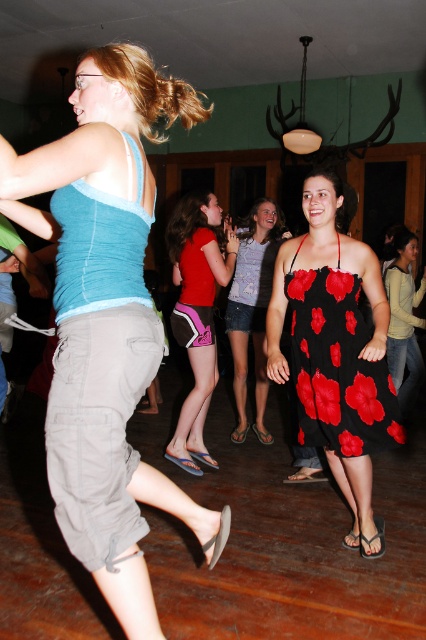
Does point (330, 317) lie behind point (196, 468)?

No, it is in front of (196, 468).

Can you confirm if black floral dress at center is positioned to the right of matte red shorts at center?

Correct, you'll find black floral dress at center to the right of matte red shorts at center.

What do you see at coordinates (336, 365) in the screenshot? I see `black floral dress at center` at bounding box center [336, 365].

Image resolution: width=426 pixels, height=640 pixels. I want to click on black floral dress at center, so click(x=336, y=365).

Which is above, matte blue tank top at center or floral print dress at center?

floral print dress at center is higher up.

Which is in front, point (92, 209) or point (262, 342)?

Point (92, 209)

Is point (201, 529) farther from camera compared to point (273, 232)?

No, it is in front of (273, 232).

Locate an element on the screen. This screenshot has width=426, height=640. matte blue tank top at center is located at coordinates (106, 321).

Based on the photo, does matte red shorts at center have a lesser width compared to floral print dress at center?

Correct, matte red shorts at center's width is less than floral print dress at center's.

Between matte red shorts at center and floral print dress at center, which one appears on the left side from the viewer's perspective?

Positioned to the left is matte red shorts at center.

Does point (190, 288) come closer to viewer compared to point (259, 253)?

Yes.

The height and width of the screenshot is (640, 426). What are the coordinates of `matte red shorts at center` in the screenshot? It's located at (196, 312).